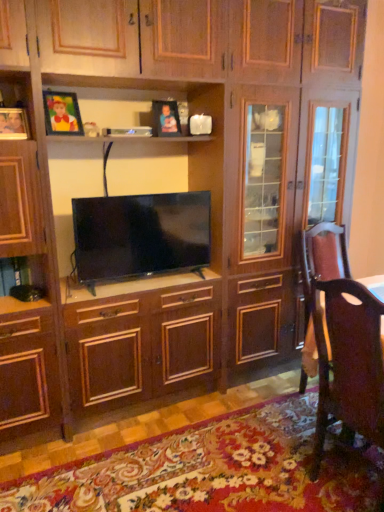
Question: Is matte wooden picture frame at upper left, the second picture frame when ordered from front to back, at the left side of matte wooden picture frame at upper left, arranged as the third picture frame when viewed from the back?

Choices:
 (A) no
 (B) yes

Answer: (A)

Question: Is matte wooden picture frame at upper left, acting as the 2th picture frame starting from the back, far from matte wooden picture frame at upper left, acting as the 3th picture frame starting from the right?

Choices:
 (A) no
 (B) yes

Answer: (A)

Question: Can you confirm if matte wooden picture frame at upper left, the second picture frame when ordered from front to back, is smaller than matte wooden picture frame at upper left, arranged as the third picture frame when viewed from the back?

Choices:
 (A) yes
 (B) no

Answer: (B)

Question: Is matte wooden picture frame at upper left, the second picture frame when ordered from right to left, behind matte wooden picture frame at upper left, acting as the 3th picture frame starting from the right?

Choices:
 (A) no
 (B) yes

Answer: (B)

Question: Does matte wooden picture frame at upper left, the second picture frame when ordered from right to left, lie in front of matte wooden picture frame at upper left, arranged as the third picture frame when viewed from the back?

Choices:
 (A) no
 (B) yes

Answer: (A)

Question: From the image's perspective, is matte wooden picture frame at upper left, acting as the 2th picture frame starting from the back, beneath matte wooden picture frame at upper left, the first picture frame from the front?

Choices:
 (A) yes
 (B) no

Answer: (B)

Question: Does matte plastic picture frame at upper center, arranged as the first picture frame when viewed from the right, have a smaller size compared to matte black tv at center?

Choices:
 (A) no
 (B) yes

Answer: (B)

Question: Considering the relative positions of matte plastic picture frame at upper center, arranged as the first picture frame when viewed from the right, and matte black tv at center in the image provided, is matte plastic picture frame at upper center, arranged as the first picture frame when viewed from the right, to the left of matte black tv at center from the viewer's perspective?

Choices:
 (A) no
 (B) yes

Answer: (A)

Question: Does matte plastic picture frame at upper center, positioned as the third picture frame in front-to-back order, have a larger size compared to matte black tv at center?

Choices:
 (A) yes
 (B) no

Answer: (B)

Question: From a real-world perspective, is matte plastic picture frame at upper center, the 1th picture frame when ordered from back to front, over matte black tv at center?

Choices:
 (A) yes
 (B) no

Answer: (A)

Question: Considering the relative positions of matte plastic picture frame at upper center, positioned as the third picture frame in front-to-back order, and matte black tv at center in the image provided, is matte plastic picture frame at upper center, positioned as the third picture frame in front-to-back order, to the right of matte black tv at center from the viewer's perspective?

Choices:
 (A) yes
 (B) no

Answer: (A)

Question: Is matte plastic picture frame at upper center, the 1th picture frame when ordered from back to front, shorter than matte black tv at center?

Choices:
 (A) yes
 (B) no

Answer: (A)

Question: Does matte black tv at center appear on the left side of matte plastic picture frame at upper center, the third picture frame in the left-to-right sequence?

Choices:
 (A) no
 (B) yes

Answer: (B)